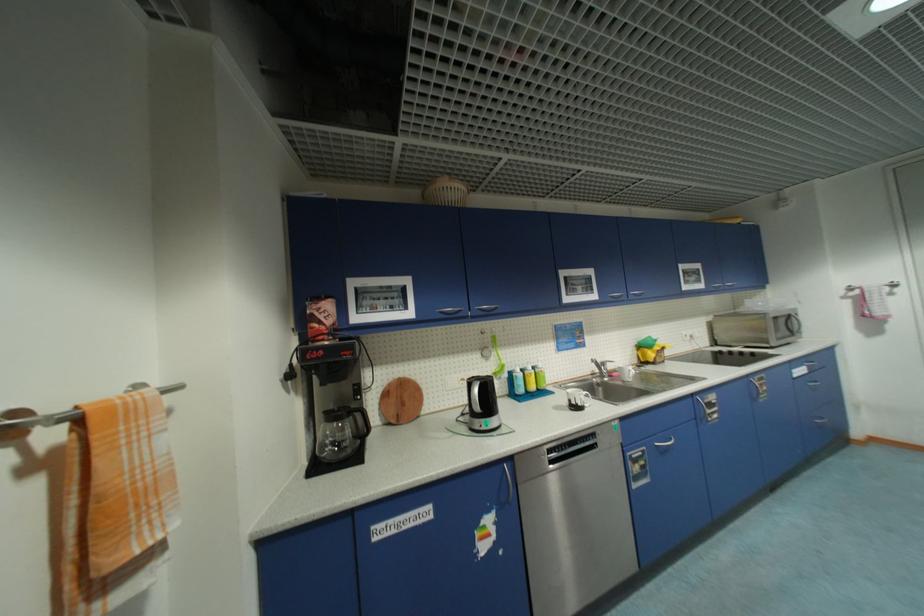
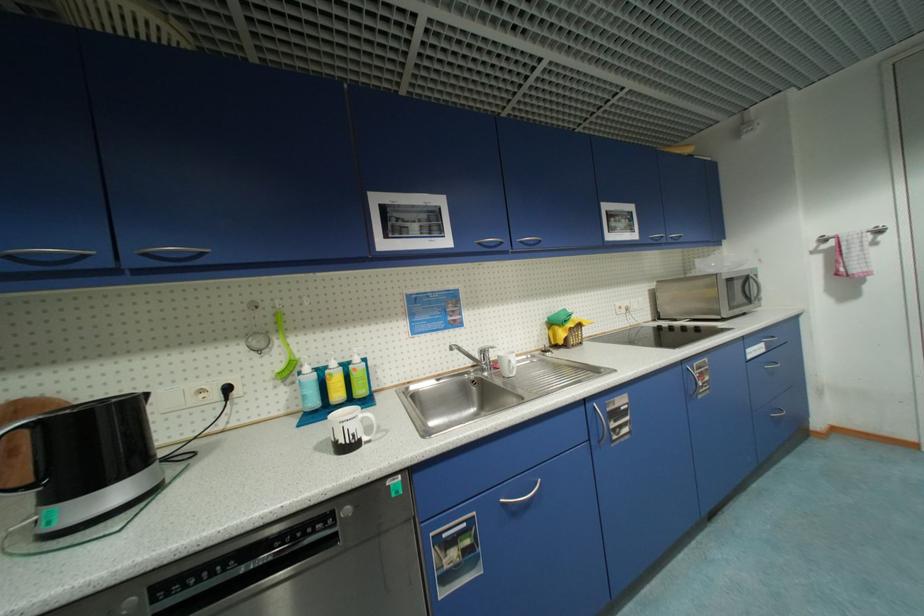
Which direction would the cameraman need to move to produce the second image?

The cameraman moved toward right, forward.